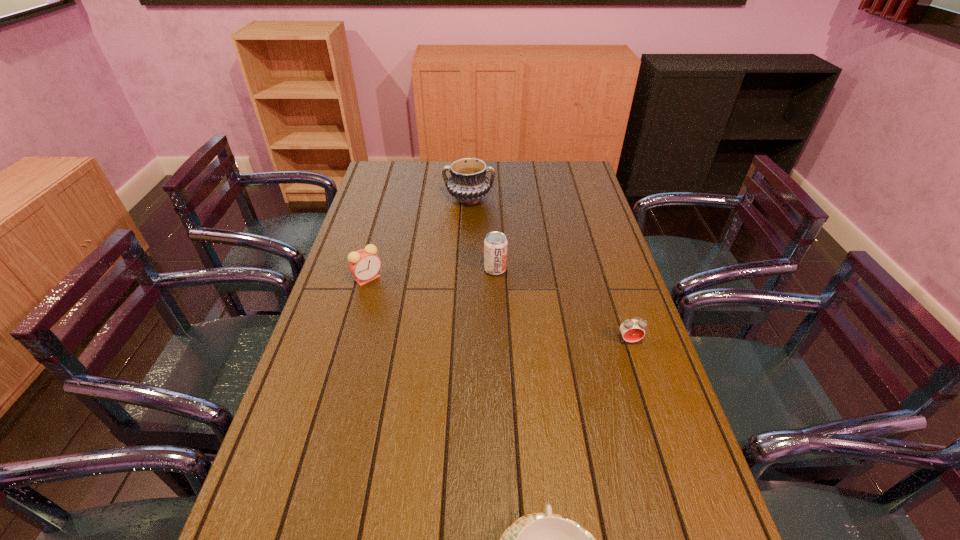
You are a GUI agent. You are given a task and a screenshot of the screen. Output one action in this format:
    pyautogui.click(x=<x>, y=<y>)
    Task: Click on the pottery
    The height and width of the screenshot is (540, 960).
    Given the screenshot: What is the action you would take?
    pyautogui.click(x=468, y=183)

Identify the location of soda can. The height and width of the screenshot is (540, 960). (495, 244).

Where is `the taller alarm clock`? the taller alarm clock is located at coordinates [x=364, y=264].

Where is `the farther alarm clock`? The width and height of the screenshot is (960, 540). the farther alarm clock is located at coordinates (364, 264).

At what (x,y) coordinates should I click in order to perform the action: click on the right alarm clock. Please return your answer as a coordinate pair (x, y). The width and height of the screenshot is (960, 540). Looking at the image, I should click on (632, 330).

At what (x,y) coordinates should I click in order to perform the action: click on the shorter alarm clock. Please return your answer as a coordinate pair (x, y). Image resolution: width=960 pixels, height=540 pixels. Looking at the image, I should click on (632, 330).

Locate an element on the screen. This screenshot has height=540, width=960. vacant area situated 0.290m on the front of the pottery is located at coordinates (467, 259).

In order to click on vacant region located on the back of the soda can in this screenshot , I will do `click(494, 247)`.

This screenshot has width=960, height=540. In order to click on vacant space located on the face of the leftmost object in this screenshot , I will do `click(360, 306)`.

Find the location of a particular element. The width and height of the screenshot is (960, 540). vacant space located on the face of the second nearest object is located at coordinates (669, 465).